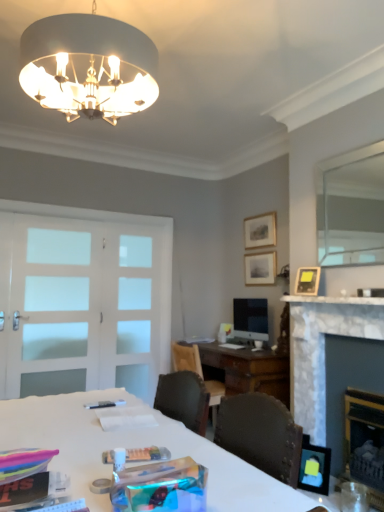
Measure the distance between gold-framed picture at upper center, the first picture frame when ordered from back to front, and camera.

gold-framed picture at upper center, the first picture frame when ordered from back to front, is 4.05 meters away from camera.

Describe the element at coordinates (139, 446) in the screenshot. This screenshot has width=384, height=512. I see `white glossy desk at center` at that location.

In order to face white glossy desk at center, should I rotate leftwards or rightwards?

You should look left and rotate roughly 12.096 degrees.

The height and width of the screenshot is (512, 384). What are the coordinates of `clear glass mirror at upper right` in the screenshot? It's located at (352, 213).

The height and width of the screenshot is (512, 384). I want to click on satin black monitor at center, so click(x=251, y=318).

Identify the location of wooden chair at center. The width and height of the screenshot is (384, 512). (186, 358).

Is white glass chandelier at upper center aimed at matte black picture frame at upper right, placed as the 2th picture frame when sorted from front to back?

No.

How much distance is there between white glass chandelier at upper center and matte black picture frame at upper right, marked as the third picture frame in a top-to-bottom arrangement?

white glass chandelier at upper center is 6.17 feet from matte black picture frame at upper right, marked as the third picture frame in a top-to-bottom arrangement.

From the image's perspective, which one is positioned lower, white glass chandelier at upper center or matte black picture frame at upper right, which is the second picture frame from bottom to top?

matte black picture frame at upper right, which is the second picture frame from bottom to top, from the image's perspective.

Considering the positions of point (55, 47) and point (297, 276), is point (55, 47) closer or farther from the camera than point (297, 276)?

Point (55, 47) is positioned closer to the camera compared to point (297, 276).

Which object is further away from the camera taking this photo, marble fireplace at right or white glass chandelier at upper center?

marble fireplace at right.

Considering the sizes of objects marble fireplace at right and white glass chandelier at upper center in the image provided, who is shorter, marble fireplace at right or white glass chandelier at upper center?

With less height is white glass chandelier at upper center.

Would you say marble fireplace at right contains white glass chandelier at upper center?

No, white glass chandelier at upper center is located outside of marble fireplace at right.

From a real-world perspective, which is physically above, marble fireplace at right or white glass chandelier at upper center?

white glass chandelier at upper center is physically above.

Find the location of a particular element. fireplace above the matte black picture frame at lower right, which is the 4th picture frame from top to bottom (from the image's perspective) is located at coordinates (323, 349).

Based on the photo, considering the sizes of objects marble fireplace at right and matte black picture frame at lower right, which is the 4th picture frame from top to bottom, in the image provided, who is taller, marble fireplace at right or matte black picture frame at lower right, which is the 4th picture frame from top to bottom,?

With more height is marble fireplace at right.

In terms of width, does marble fireplace at right look wider or thinner when compared to matte black picture frame at lower right, which is counted as the 4th picture frame, starting from the back?

Considering their sizes, marble fireplace at right looks broader than matte black picture frame at lower right, which is counted as the 4th picture frame, starting from the back.

Looking at this image, can you confirm if marble fireplace at right is positioned to the left of matte black picture frame at lower right, which is counted as the 4th picture frame, starting from the back?

No.

Can you confirm if gold-framed picture at upper center, the first picture frame when ordered from back to front, is positioned to the right of marble fireplace at right?

No.

From the image's perspective, between gold-framed picture at upper center, arranged as the 4th picture frame when viewed from the front, and marble fireplace at right, which one is located above?

From the image's view, gold-framed picture at upper center, arranged as the 4th picture frame when viewed from the front, is above.

Is gold-framed picture at upper center, marked as the 1th picture frame in a top-to-bottom arrangement, wider or thinner than marble fireplace at right?

Considering their sizes, gold-framed picture at upper center, marked as the 1th picture frame in a top-to-bottom arrangement, looks slimmer than marble fireplace at right.

How much distance is there between gold-framed picture at upper center, which is the 4th picture frame from bottom to top, and marble fireplace at right?

gold-framed picture at upper center, which is the 4th picture frame from bottom to top, is 4.32 feet from marble fireplace at right.

Can you confirm if matte black picture frame at lower right, which is counted as the 4th picture frame, starting from the back, is thinner than clear glass mirror at upper right?

No, matte black picture frame at lower right, which is counted as the 4th picture frame, starting from the back, is not thinner than clear glass mirror at upper right.

Does point (310, 475) lie behind point (327, 203)?

No, it is not.

In the scene shown: Which object is more forward, matte black picture frame at lower right, arranged as the 1th picture frame when ordered from the bottom, or clear glass mirror at upper right?

clear glass mirror at upper right is closer to the camera.

From the picture: Is matte black picture frame at upper right, marked as the third picture frame in a top-to-bottom arrangement, positioned with its back to satin black monitor at center?

No, matte black picture frame at upper right, marked as the third picture frame in a top-to-bottom arrangement, is not facing away from satin black monitor at center.

Can you confirm if matte black picture frame at upper right, marked as the third picture frame in a top-to-bottom arrangement, is wider than satin black monitor at center?

Yes.

The height and width of the screenshot is (512, 384). In order to click on the 1st picture frame in front of the satin black monitor at center in this screenshot , I will do `click(307, 281)`.

Which object is thinner, marble fireplace at right or gold-framed picture at upper center, the first picture frame when ordered from back to front?

Thinner between the two is gold-framed picture at upper center, the first picture frame when ordered from back to front.

Locate an element on the screen. Image resolution: width=384 pixels, height=512 pixels. fireplace below the gold-framed picture at upper center, which is the 4th picture frame from bottom to top (from a real-world perspective) is located at coordinates (323, 349).

Which object is closer to the camera, marble fireplace at right or gold-framed picture at upper center, which is the 4th picture frame from bottom to top?

marble fireplace at right is in front.

Looking at this image, considering the relative positions of marble fireplace at right and gold-framed picture at upper center, arranged as the 4th picture frame when viewed from the front, in the image provided, is marble fireplace at right to the right of gold-framed picture at upper center, arranged as the 4th picture frame when viewed from the front, from the viewer's perspective?

Indeed, marble fireplace at right is positioned on the right side of gold-framed picture at upper center, arranged as the 4th picture frame when viewed from the front.

Where is `the 4th picture frame to the right when counting from the white glass chandelier at upper center`? the 4th picture frame to the right when counting from the white glass chandelier at upper center is located at coordinates (307, 281).

This screenshot has width=384, height=512. Find the location of `lamp that appears in front of the marble fireplace at right`. lamp that appears in front of the marble fireplace at right is located at coordinates (88, 66).

When comparing their distances from white frosted glass door at left, the second screen door when ordered from right to left, does gold-framed picture at upper center, arranged as the 4th picture frame when viewed from the front, or matte silver picture frame at upper center, positioned as the 2th picture frame in top-to-bottom order, seem further?

gold-framed picture at upper center, arranged as the 4th picture frame when viewed from the front, is further to white frosted glass door at left, the second screen door when ordered from right to left.

Estimate the real-world distances between objects in this image. Which object is closer to satin black monitor at center, matte black picture frame at lower right, which is the 4th picture frame from top to bottom, or white frosted glass door at left, the second screen door when ordered from right to left?

matte black picture frame at lower right, which is the 4th picture frame from top to bottom, lies closer to satin black monitor at center than the other object.

Considering their positions, is clear glass mirror at upper right positioned closer to white glossy desk at center than matte silver picture frame at upper center, positioned as the 2th picture frame in top-to-bottom order?

clear glass mirror at upper right is positioned closer to the anchor white glossy desk at center.

Looking at the image, which one is located closer to white frosted glass screen door at center, which is the 2th screen door in left-to-right order, matte black picture frame at lower right, which is counted as the 4th picture frame, starting from the back, or marble fireplace at right?

The object closer to white frosted glass screen door at center, which is the 2th screen door in left-to-right order, is marble fireplace at right.

Based on their spatial positions, is marble fireplace at right or clear glass mirror at upper right further from white glossy desk at center?

Among the two, clear glass mirror at upper right is located further to white glossy desk at center.

Based on their spatial positions, is white glossy desk at center or matte black picture frame at lower right, which is counted as the 4th picture frame, starting from the back, further from matte black picture frame at upper right, placed as the 2th picture frame when sorted from front to back?

The object further to matte black picture frame at upper right, placed as the 2th picture frame when sorted from front to back, is white glossy desk at center.

Considering their positions, is white frosted glass screen door at center, marked as the first screen door in a right-to-left arrangement, positioned closer to wooden chair at center than satin black monitor at center?

satin black monitor at center.

Considering their positions, is white glass chandelier at upper center positioned further to matte black picture frame at upper right, placed as the 2th picture frame when sorted from front to back, than gold-framed picture at upper center, arranged as the 4th picture frame when viewed from the front?

white glass chandelier at upper center lies further to matte black picture frame at upper right, placed as the 2th picture frame when sorted from front to back, than the other object.

Find the location of a particular element. chair between white frosted glass door at left, marked as the first screen door in a left-to-right arrangement, and matte silver picture frame at upper center, arranged as the 2th picture frame when viewed from the back is located at coordinates (186, 358).

You are a GUI agent. You are given a task and a screenshot of the screen. Output one action in this format:
    pyautogui.click(x=<x>, y=<y>)
    Task: Click on the fireplace positioned between white glass chandelier at upper center and satin black monitor at center from near to far
    Image resolution: width=384 pixels, height=512 pixels.
    Given the screenshot: What is the action you would take?
    pyautogui.click(x=323, y=349)

You are a GUI agent. You are given a task and a screenshot of the screen. Output one action in this format:
    pyautogui.click(x=<x>, y=<y>)
    Task: Click on the fireplace between white glass chandelier at upper center and wooden chair at center in the vertical direction
    The height and width of the screenshot is (512, 384).
    Given the screenshot: What is the action you would take?
    pyautogui.click(x=323, y=349)

Find the location of a particular element. This screenshot has width=384, height=512. picture frame between matte black picture frame at lower right, which is counted as the 4th picture frame, starting from the back, and matte silver picture frame at upper center, which is the 3th picture frame in front-to-back order, in the front-back direction is located at coordinates (307, 281).